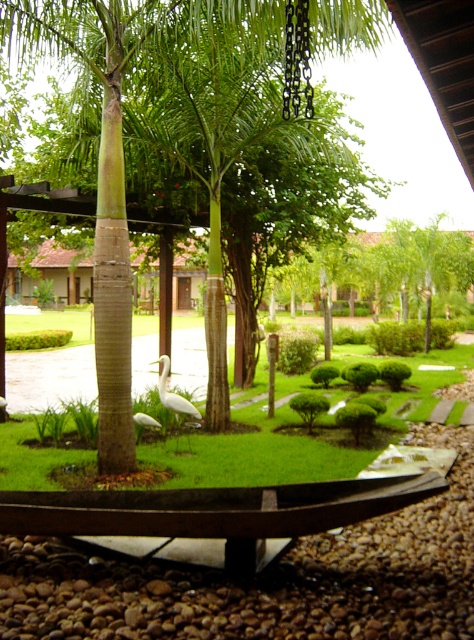
Question: Considering the relative positions of green textured palm tree at center and white matte swan at center in the image provided, where is green textured palm tree at center located with respect to white matte swan at center?

Choices:
 (A) right
 (B) left

Answer: (B)

Question: Which of the following is the farthest from the observer?

Choices:
 (A) (136, 420)
 (B) (164, 403)
 (C) (237, 397)
 (D) (200, 64)

Answer: (C)

Question: Does green grass at center appear over white matte swan at center?

Choices:
 (A) yes
 (B) no

Answer: (B)

Question: Which is farther from the green textured palm tree at center?

Choices:
 (A) green grass at center
 (B) white matte bird at center
 (C) white matte swan at center

Answer: (A)

Question: Which point is closer to the camera?

Choices:
 (A) (158, 426)
 (B) (181, 486)

Answer: (B)

Question: Is green textured palm tree at center wider than white matte swan at center?

Choices:
 (A) no
 (B) yes

Answer: (A)